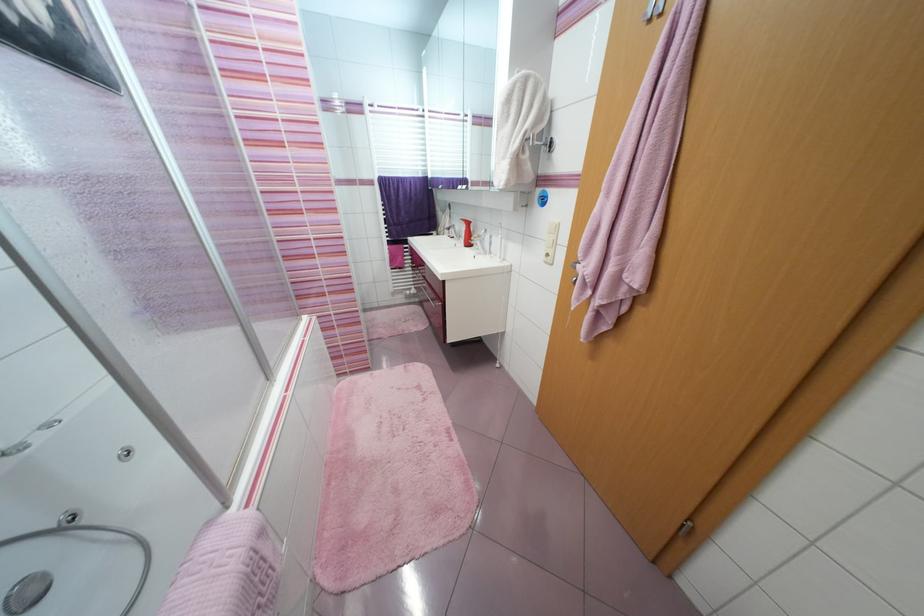
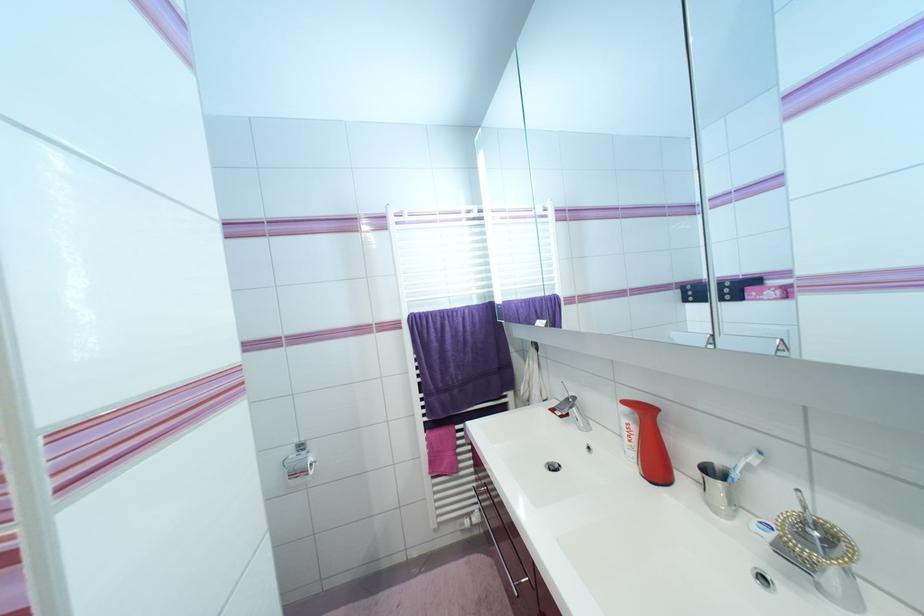
Question: Which direction would the cameraman need to move to produce the second image? Reply with the corresponding letter.

Choices:
 (A) Left
 (B) Right
 (C) Forward
 (D) Backward

Answer: (C)